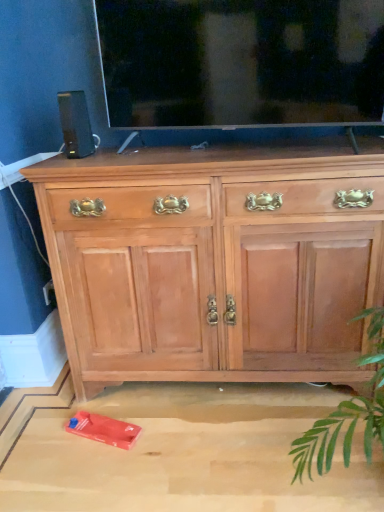
You are a GUI agent. You are given a task and a screenshot of the screen. Output one action in this format:
    pyautogui.click(x=<x>, y=<y>)
    Task: Click on the transparent glass tv at upper center
    
    Given the screenshot: What is the action you would take?
    pyautogui.click(x=242, y=62)

The image size is (384, 512). Find the location of `light wood cabinet at center`. light wood cabinet at center is located at coordinates (213, 263).

I want to click on transparent glass tv at upper center, so click(242, 62).

Is transparent glass tv at upper center facing towards black plastic speaker at upper left?

No, transparent glass tv at upper center is not turned towards black plastic speaker at upper left.

Based on their sizes in the image, would you say transparent glass tv at upper center is bigger or smaller than black plastic speaker at upper left?

transparent glass tv at upper center is bigger than black plastic speaker at upper left.

Considering the relative positions of transparent glass tv at upper center and black plastic speaker at upper left in the image provided, is transparent glass tv at upper center to the left of black plastic speaker at upper left from the viewer's perspective?

No, transparent glass tv at upper center is not to the left of black plastic speaker at upper left.

Can we say transparent glass tv at upper center lies outside black plastic speaker at upper left?

That's correct, transparent glass tv at upper center is outside of black plastic speaker at upper left.

From a real-world perspective, which object stands above the other?

transparent glass tv at upper center is physically above.

Considering the sizes of transparent glass tv at upper center and light wood cabinet at center in the image, is transparent glass tv at upper center wider or thinner than light wood cabinet at center?

In the image, transparent glass tv at upper center appears to be more narrow than light wood cabinet at center.

Which is in front, point (175, 91) or point (269, 330)?

The point (175, 91) is more forward.

Does transparent glass tv at upper center touch light wood cabinet at center?

No, transparent glass tv at upper center is not next to light wood cabinet at center.

Identify the location of chest of drawers in front of the black plastic speaker at upper left. Image resolution: width=384 pixels, height=512 pixels. (213, 263).

Does light wood cabinet at center have a lesser width compared to black plastic speaker at upper left?

No.

From the image's perspective, is light wood cabinet at center positioned above or below black plastic speaker at upper left?

Based on their image positions, light wood cabinet at center is located beneath black plastic speaker at upper left.

Considering the relative sizes of black plastic speaker at upper left and light wood cabinet at center in the image provided, is black plastic speaker at upper left taller than light wood cabinet at center?

In fact, black plastic speaker at upper left may be shorter than light wood cabinet at center.

Based on the photo, which of these two, black plastic speaker at upper left or light wood cabinet at center, is wider?

light wood cabinet at center.

Is black plastic speaker at upper left aimed at light wood cabinet at center?

No, black plastic speaker at upper left is not facing towards light wood cabinet at center.

Between light wood cabinet at center and transparent glass tv at upper center, which one has more height?

light wood cabinet at center.

Considering the sizes of light wood cabinet at center and transparent glass tv at upper center in the image, is light wood cabinet at center bigger or smaller than transparent glass tv at upper center?

Clearly, light wood cabinet at center is larger in size than transparent glass tv at upper center.

Considering the sizes of light wood cabinet at center and transparent glass tv at upper center in the image, is light wood cabinet at center wider or thinner than transparent glass tv at upper center?

light wood cabinet at center is wider than transparent glass tv at upper center.

From a real-world perspective, between light wood cabinet at center and transparent glass tv at upper center, who is vertically higher?

From a 3D spatial view, transparent glass tv at upper center is above.

Does black plastic speaker at upper left have a larger size compared to transparent glass tv at upper center?

Actually, black plastic speaker at upper left might be smaller than transparent glass tv at upper center.

Which is more to the right, black plastic speaker at upper left or transparent glass tv at upper center?

transparent glass tv at upper center is more to the right.

Is black plastic speaker at upper left positioned with its back to transparent glass tv at upper center?

No, black plastic speaker at upper left is not facing away from transparent glass tv at upper center.

Based on the photo, which is farther, (x=68, y=146) or (x=128, y=50)?

The point (x=128, y=50) is behind.

The image size is (384, 512). What are the coordinates of `speaker to the left of transparent glass tv at upper center` in the screenshot? It's located at (75, 124).

Find the location of a particular element. The height and width of the screenshot is (512, 384). glass door on the right of the light wood cabinet at center is located at coordinates (242, 62).

Looking at the image, which one is located further to light wood cabinet at center, black plastic speaker at upper left or transparent glass tv at upper center?

The object further to light wood cabinet at center is black plastic speaker at upper left.

Looking at the image, which one is located closer to light wood cabinet at center, transparent glass tv at upper center or black plastic speaker at upper left?

transparent glass tv at upper center.

From the image, which object appears to be farther from transparent glass tv at upper center, black plastic speaker at upper left or light wood cabinet at center?

light wood cabinet at center is further to transparent glass tv at upper center.

Considering their positions, is transparent glass tv at upper center positioned closer to black plastic speaker at upper left than light wood cabinet at center?

Among the two, transparent glass tv at upper center is located nearer to black plastic speaker at upper left.

Looking at the image, which one is located further to transparent glass tv at upper center, light wood cabinet at center or black plastic speaker at upper left?

Among the two, light wood cabinet at center is located further to transparent glass tv at upper center.

Which object lies nearer to the anchor point black plastic speaker at upper left, light wood cabinet at center or transparent glass tv at upper center?

transparent glass tv at upper center.

What are the coordinates of `speaker between transparent glass tv at upper center and light wood cabinet at center in the vertical direction` in the screenshot? It's located at (75, 124).